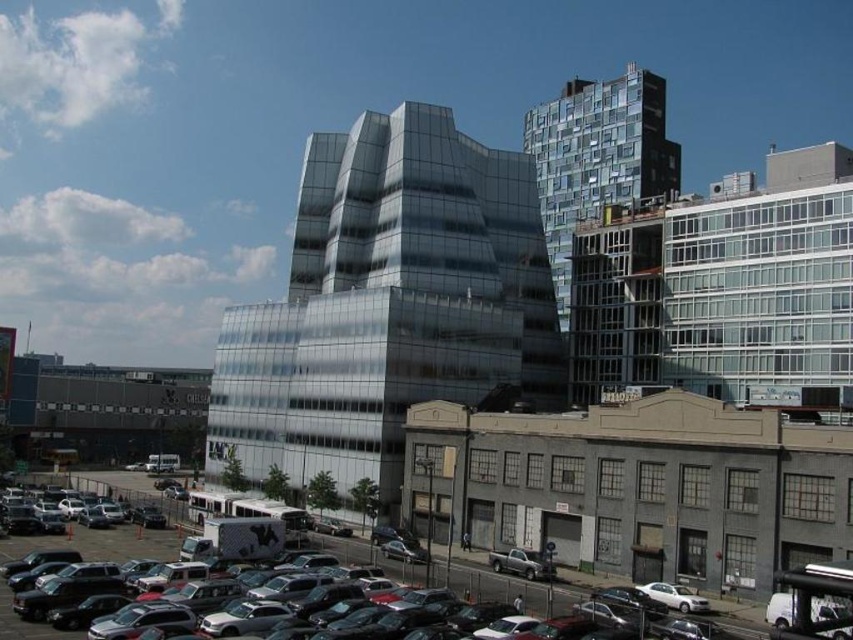
Can you confirm if dark gray asphalt parking lot at lower left is smaller than shiny black sedan at lower left?

Answer: Incorrect, dark gray asphalt parking lot at lower left is not smaller in size than shiny black sedan at lower left.

The image size is (853, 640). What do you see at coordinates (102, 541) in the screenshot? I see `dark gray asphalt parking lot at lower left` at bounding box center [102, 541].

This screenshot has width=853, height=640. Identify the location of dark gray asphalt parking lot at lower left. (102, 541).

Between dark gray asphalt parking lot at lower left and silver metallic sedan at center, which one has more height?

dark gray asphalt parking lot at lower left is taller.

Between point (161, 544) and point (96, 486), which one is positioned in front?

Point (161, 544)

Who is more forward, (378,554) or (125,513)?

Point (378,554) is in front.

Locate an element on the screen. This screenshot has width=853, height=640. dark gray asphalt parking lot at lower left is located at coordinates (102, 541).

Which is more to the left, shiny black sedan at lower left or silver metallic sedan at center?

From the viewer's perspective, silver metallic sedan at center appears more on the left side.

From the picture: Which is below, shiny black sedan at lower left or silver metallic sedan at center?

silver metallic sedan at center is below.

Is point (119, 561) more distant than point (140, 499)?

No.

Where is `shiny black sedan at lower left`? shiny black sedan at lower left is located at coordinates click(503, 588).